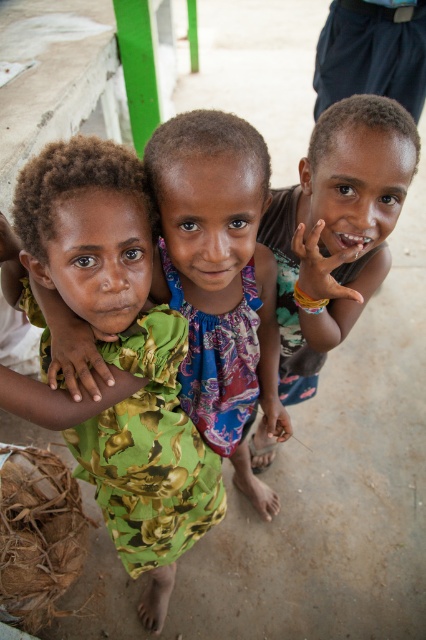
You are a photographer trying to capture the three children in the scene. You notice two points marked in the image. The first point is at coordinate point(112, 515) and the second is at point(333, 340). Which point is closer to the photographer?

Point(333, 340) is closer to the photographer because it is in front of point(112, 515).

You are a photographer trying to capture a clear photo of the green floral dress at center and the brown matte skin at center. Since the camera can only focus on one subject at a time, which one should you choose to ensure the other is still somewhat in focus?

The green floral dress at center is in front of the brown matte skin at center. To keep both somewhat in focus, you should focus on the brown matte skin at center, as it is further back, which increases the depth of field and keeps the foreground subject more in focus as well.

You are a photographer trying to capture a candid shot of the children. You notice the green floral dress at center and the brown matte skin at center. Which object is positioned lower in the image?

The green floral dress at center is below brown matte skin at center, so the green floral dress at center is positioned lower in the image.